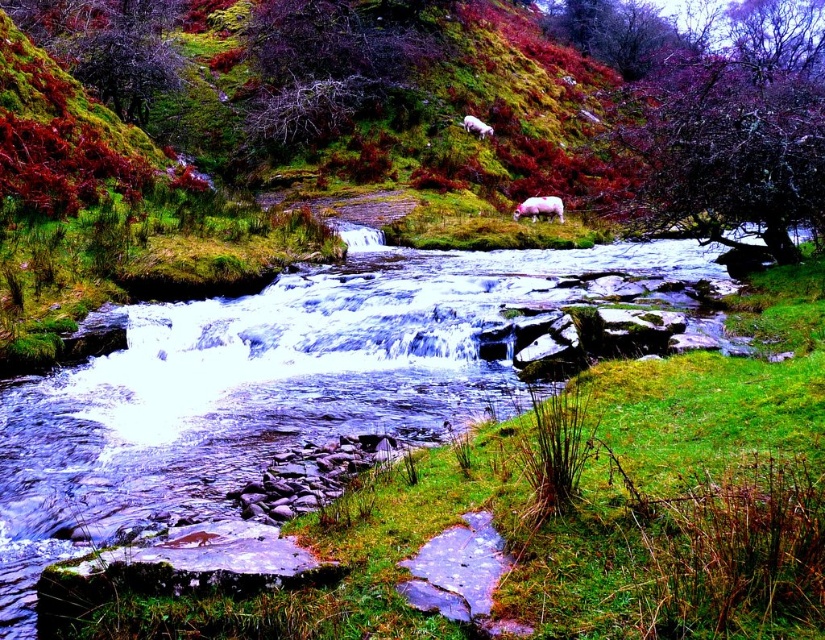
You are a hiker trying to cross the stream. You see the green grass at center and the dark purple textured branch at upper center. Which object is closer to the ground?

The green grass at center is shorter than the dark purple textured branch at upper center, so the green grass at center is closer to the ground.

You are a hiker who wants to cross the stream safely. You notice the green grass at center and the dark purple textured branch at upper center. Which object is closer to your current position if you are standing on the bank near the stream?

The green grass at center is closer to your current position because it is located at the center of the scene, while the dark purple textured branch at upper center is positioned higher up, making it farther away.